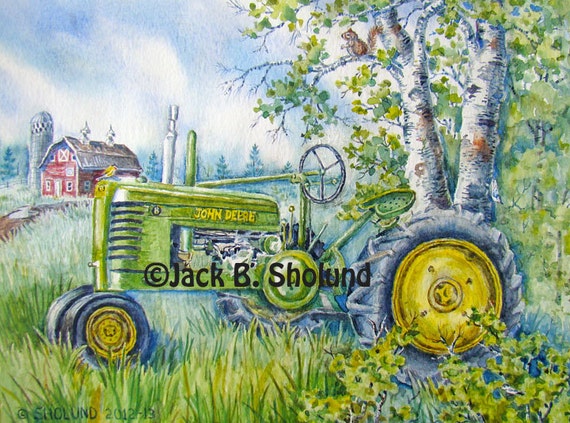
At what (x,y) coordinates should I click in order to perform the action: click on green seat. Please return your answer as a coordinate pair (x, y). This screenshot has height=423, width=570. Looking at the image, I should click on (394, 202).